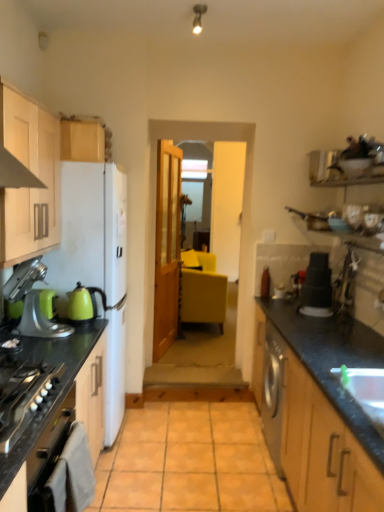
Question: Is metallic silver stand mixer at left, the first kitchen appliance viewed from the front, at the back of satin nickel faucet at right?

Choices:
 (A) yes
 (B) no

Answer: (B)

Question: From a real-world perspective, is satin nickel faucet at right located higher than metallic silver stand mixer at left, which is the second kitchen appliance in back-to-front order?

Choices:
 (A) yes
 (B) no

Answer: (A)

Question: Is satin nickel faucet at right not close to metallic silver stand mixer at left, the first kitchen appliance viewed from the front?

Choices:
 (A) yes
 (B) no

Answer: (A)

Question: Is satin nickel faucet at right located outside metallic silver stand mixer at left, which is the second kitchen appliance in back-to-front order?

Choices:
 (A) no
 (B) yes

Answer: (B)

Question: Considering the relative sizes of satin nickel faucet at right and metallic silver stand mixer at left, the first kitchen appliance viewed from the front, in the image provided, is satin nickel faucet at right shorter than metallic silver stand mixer at left, the first kitchen appliance viewed from the front,?

Choices:
 (A) yes
 (B) no

Answer: (B)

Question: From the image's perspective, is satin nickel faucet at right over metallic silver stand mixer at left, which is the second kitchen appliance in back-to-front order?

Choices:
 (A) yes
 (B) no

Answer: (A)

Question: Does white glossy sink at lower right lie behind wooden cabinet at upper left, which appears as the second cabinetry when viewed from the front?

Choices:
 (A) no
 (B) yes

Answer: (A)

Question: From the image's perspective, is white glossy sink at lower right on wooden cabinet at upper left, the first cabinetry from the back?

Choices:
 (A) yes
 (B) no

Answer: (B)

Question: Can you confirm if white glossy sink at lower right is thinner than wooden cabinet at upper left, the first cabinetry from the back?

Choices:
 (A) no
 (B) yes

Answer: (B)

Question: Is white glossy sink at lower right turned away from wooden cabinet at upper left, which appears as the second cabinetry when viewed from the front?

Choices:
 (A) yes
 (B) no

Answer: (B)

Question: Is white glossy sink at lower right to the left of wooden cabinet at upper left, which appears as the second cabinetry when viewed from the front, from the viewer's perspective?

Choices:
 (A) no
 (B) yes

Answer: (A)

Question: From a real-world perspective, is white glossy sink at lower right located higher than wooden cabinet at upper left, the first cabinetry from the back?

Choices:
 (A) yes
 (B) no

Answer: (B)

Question: Considering the relative sizes of black granite countertop at left, acting as the second countertop starting from the right, and matte black stack at right in the image provided, is black granite countertop at left, acting as the second countertop starting from the right, thinner than matte black stack at right?

Choices:
 (A) no
 (B) yes

Answer: (A)